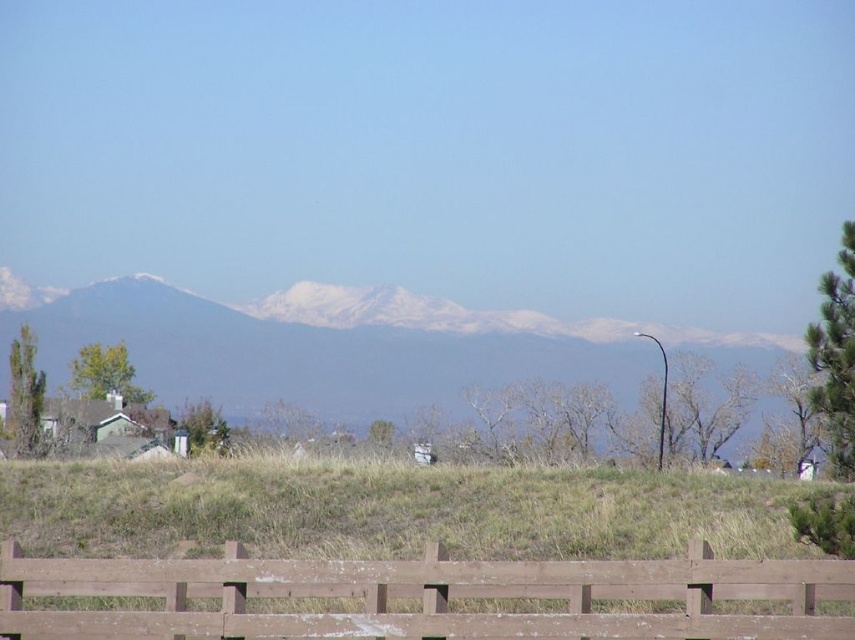
Question: Does green grassy hill at center appear on the right side of brown wooden fence at lower center?

Choices:
 (A) no
 (B) yes

Answer: (A)

Question: Based on their relative distances, which object is nearer to the green grassy hill at center?

Choices:
 (A) snowy white mountains at center
 (B) brown wooden fence at lower center

Answer: (B)

Question: Can you confirm if brown wooden fence at lower center is smaller than snowy white mountains at center?

Choices:
 (A) yes
 (B) no

Answer: (A)

Question: Among these points, which one is nearest to the camera?

Choices:
 (A) (195, 493)
 (B) (246, 586)

Answer: (B)

Question: Estimate the real-world distances between objects in this image. Which object is closer to the green grassy hill at center?

Choices:
 (A) brown wooden fence at lower center
 (B) snowy white mountains at center

Answer: (A)

Question: Can you confirm if green grassy hill at center is positioned below snowy white mountains at center?

Choices:
 (A) yes
 (B) no

Answer: (B)